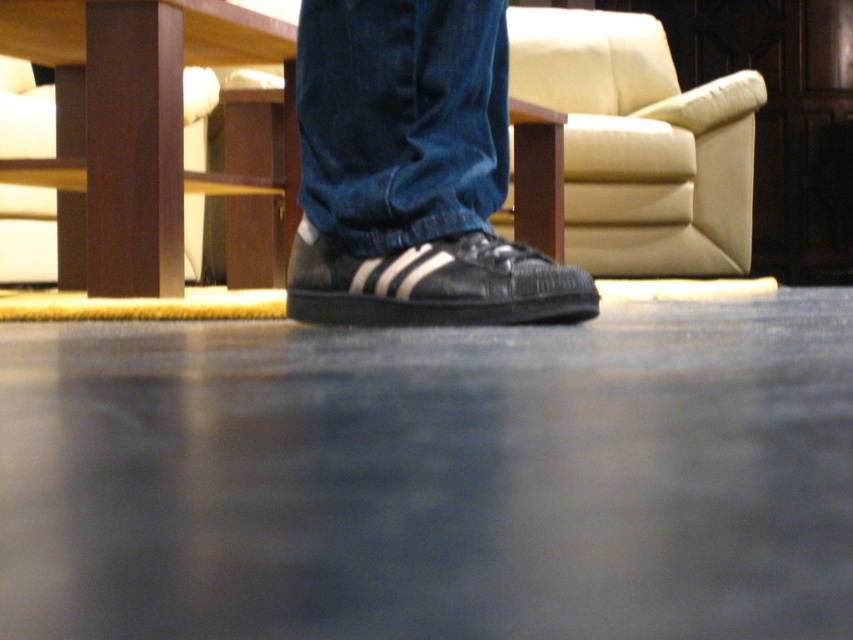
Question: Can you confirm if brown wood stool at lower left is positioned to the left of denim at center?

Choices:
 (A) no
 (B) yes

Answer: (B)

Question: Among these points, which one is nearest to the camera?

Choices:
 (A) (722, 177)
 (B) (376, 173)
 (C) (148, 116)

Answer: (B)

Question: Is beige leather armchair at upper center below black leather shoe at center?

Choices:
 (A) no
 (B) yes

Answer: (A)

Question: Which of the following is the closest to the observer?

Choices:
 (A) (306, 145)
 (B) (386, 285)
 (C) (158, 96)

Answer: (B)

Question: Which object is the farthest from the denim at center?

Choices:
 (A) beige leather armchair at upper center
 (B) black leather shoe at center
 (C) brown wood stool at lower left

Answer: (A)

Question: From the image, what is the correct spatial relationship of brown wood stool at lower left in relation to beige leather armchair at upper center?

Choices:
 (A) right
 (B) left

Answer: (B)